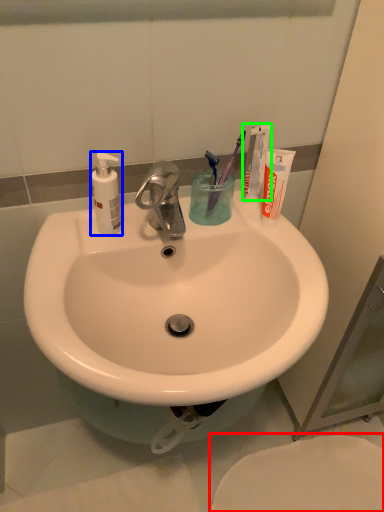
Question: Which object is positioned farthest from toilet (highlighted by a red box)? Select from soap dispenser (highlighted by a blue box) and toothpaste (highlighted by a green box).

Choices:
 (A) soap dispenser
 (B) toothpaste

Answer: (A)